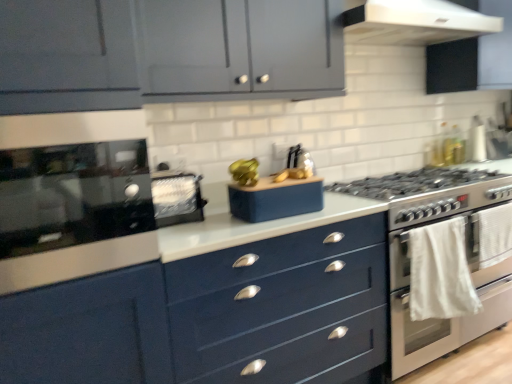
Question: Can you confirm if glossy black oven at left is taller than matte blue speaker at center, marked as the 2th appliance in a left-to-right arrangement?

Choices:
 (A) no
 (B) yes

Answer: (B)

Question: Is glossy black oven at left to the left of matte blue speaker at center, marked as the 2th appliance in a left-to-right arrangement, from the viewer's perspective?

Choices:
 (A) no
 (B) yes

Answer: (B)

Question: From the image's perspective, is glossy black oven at left below matte blue speaker at center, marked as the 1th appliance in a right-to-left arrangement?

Choices:
 (A) yes
 (B) no

Answer: (B)

Question: From the image's perspective, is glossy black oven at left on matte blue speaker at center, marked as the 1th appliance in a right-to-left arrangement?

Choices:
 (A) yes
 (B) no

Answer: (A)

Question: Does glossy black oven at left lie in front of matte blue speaker at center, marked as the 1th appliance in a right-to-left arrangement?

Choices:
 (A) yes
 (B) no

Answer: (A)

Question: From their relative heights in the image, would you say matte blue speaker at center, marked as the 1th appliance in a right-to-left arrangement, is taller or shorter than satin black toaster at upper left, the 2th appliance viewed from the right?

Choices:
 (A) short
 (B) tall

Answer: (A)

Question: Visually, is matte blue speaker at center, marked as the 2th appliance in a left-to-right arrangement, positioned to the left or to the right of satin black toaster at upper left, the 2th appliance viewed from the right?

Choices:
 (A) right
 (B) left

Answer: (A)

Question: Is matte blue speaker at center, marked as the 2th appliance in a left-to-right arrangement, bigger or smaller than satin black toaster at upper left, the 2th appliance viewed from the right?

Choices:
 (A) small
 (B) big

Answer: (A)

Question: From the image's perspective, relative to satin black toaster at upper left, which is the 1th appliance in left-to-right order, is matte blue speaker at center, marked as the 1th appliance in a right-to-left arrangement, above or below?

Choices:
 (A) below
 (B) above

Answer: (A)

Question: Considering the positions of white glossy oven at right and white fabric towel at right in the image, is white glossy oven at right taller or shorter than white fabric towel at right?

Choices:
 (A) tall
 (B) short

Answer: (A)

Question: From the image's perspective, is white glossy oven at right above or below white fabric towel at right?

Choices:
 (A) above
 (B) below

Answer: (B)

Question: Is point (508, 258) closer or farther from the camera than point (422, 274)?

Choices:
 (A) closer
 (B) farther

Answer: (B)

Question: In the image, is white glossy oven at right on the left side or the right side of white fabric towel at right?

Choices:
 (A) right
 (B) left

Answer: (A)

Question: In terms of height, does white fabric towel at right look taller or shorter compared to satin black toaster at upper left, which is the 1th appliance in left-to-right order?

Choices:
 (A) short
 (B) tall

Answer: (B)

Question: In terms of width, does white fabric towel at right look wider or thinner when compared to satin black toaster at upper left, the 2th appliance viewed from the right?

Choices:
 (A) wide
 (B) thin

Answer: (B)